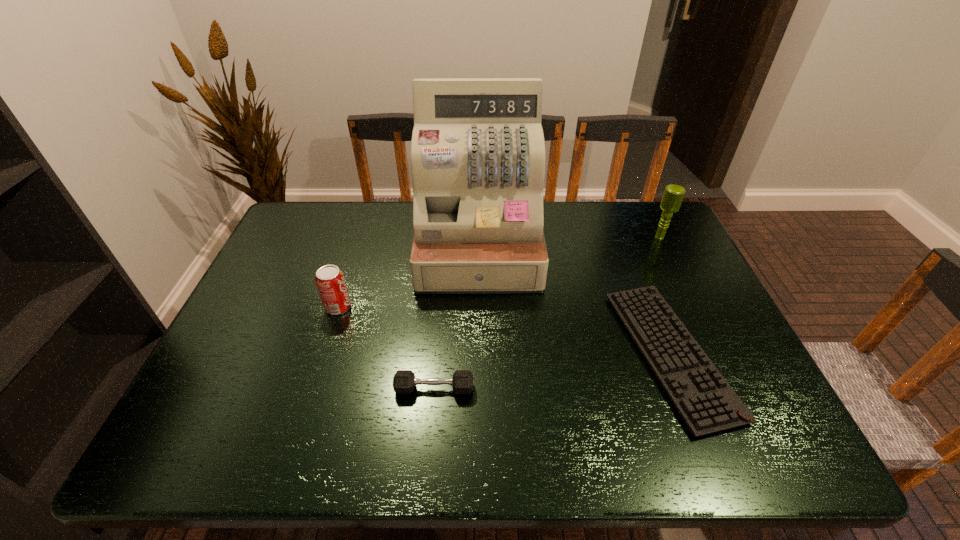
Find the location of a particular element. This screenshot has height=540, width=960. cash register is located at coordinates (478, 156).

Where is `microphone`? microphone is located at coordinates click(673, 195).

Locate an element on the screen. the leftmost object is located at coordinates (330, 281).

At what (x,y) coordinates should I click in order to perform the action: click on the third shortest object. Please return your answer as a coordinate pair (x, y). The height and width of the screenshot is (540, 960). Looking at the image, I should click on (330, 281).

What are the coordinates of `the fourth tallest object` in the screenshot? It's located at (404, 381).

At what (x,y) coordinates should I click in order to perform the action: click on computer keyboard. Please return your answer as a coordinate pair (x, y). The height and width of the screenshot is (540, 960). Looking at the image, I should click on (706, 402).

Image resolution: width=960 pixels, height=540 pixels. Find the location of `free space located on the operating side of the tallest object`. free space located on the operating side of the tallest object is located at coordinates (478, 314).

Locate an element on the screen. This screenshot has height=540, width=960. vacant space situated 0.390m on the left of the fourth shortest object is located at coordinates (530, 238).

Identify the location of free point located on the back of the leftmost object. (348, 278).

Where is `vacant point located 0.140m on the left of the dumbbell`? The image size is (960, 540). vacant point located 0.140m on the left of the dumbbell is located at coordinates (334, 388).